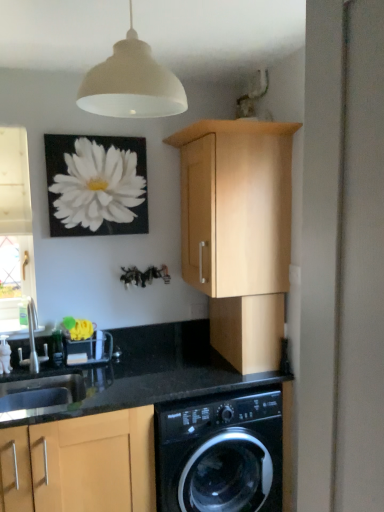
Question: From the image's perspective, would you say white matte flower at upper left is positioned over light wood cabinet at upper center, acting as the 3th cabinetry starting from the bottom?

Choices:
 (A) no
 (B) yes

Answer: (B)

Question: Is white matte flower at upper left bigger than light wood cabinet at upper center, which is counted as the first cabinetry, starting from the top?

Choices:
 (A) no
 (B) yes

Answer: (A)

Question: Is white matte flower at upper left not near light wood cabinet at upper center, acting as the 3th cabinetry starting from the bottom?

Choices:
 (A) yes
 (B) no

Answer: (B)

Question: Is white matte flower at upper left beside light wood cabinet at upper center, which is counted as the first cabinetry, starting from the top?

Choices:
 (A) no
 (B) yes

Answer: (A)

Question: Does white matte flower at upper left have a smaller size compared to light wood cabinet at upper center, acting as the 3th cabinetry starting from the bottom?

Choices:
 (A) no
 (B) yes

Answer: (B)

Question: Would you say matte wood cabinet at center, which is counted as the 2th cabinetry, starting from the top, is to the left or to the right of clear glass window at left in the picture?

Choices:
 (A) left
 (B) right

Answer: (B)

Question: Considering the positions of point (236, 336) and point (1, 217), is point (236, 336) closer or farther from the camera than point (1, 217)?

Choices:
 (A) closer
 (B) farther

Answer: (A)

Question: From the image's perspective, is matte wood cabinet at center, which is the second cabinetry from bottom to top, above or below clear glass window at left?

Choices:
 (A) below
 (B) above

Answer: (A)

Question: Relative to clear glass window at left, is matte wood cabinet at center, which is counted as the 2th cabinetry, starting from the top, in front or behind?

Choices:
 (A) behind
 (B) front

Answer: (B)

Question: Is point (26, 390) closer or farther from the camera than point (192, 402)?

Choices:
 (A) closer
 (B) farther

Answer: (B)

Question: Would you say black granite sink at lower left is to the left or to the right of black glossy washing machine at lower center in the picture?

Choices:
 (A) left
 (B) right

Answer: (A)

Question: From the image's perspective, is black granite sink at lower left located above or below black glossy washing machine at lower center?

Choices:
 (A) below
 (B) above

Answer: (B)

Question: Considering the positions of black granite sink at lower left and black glossy washing machine at lower center in the image, is black granite sink at lower left wider or thinner than black glossy washing machine at lower center?

Choices:
 (A) wide
 (B) thin

Answer: (B)

Question: Choose the correct answer: Is silver metallic faucet at lower left inside black glossy washing machine at lower center or outside it?

Choices:
 (A) outside
 (B) inside

Answer: (A)

Question: In the image, is silver metallic faucet at lower left on the left side or the right side of black glossy washing machine at lower center?

Choices:
 (A) left
 (B) right

Answer: (A)